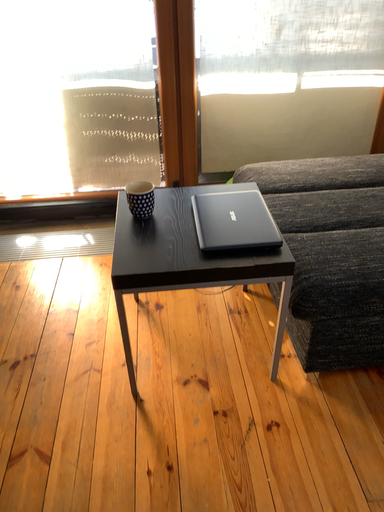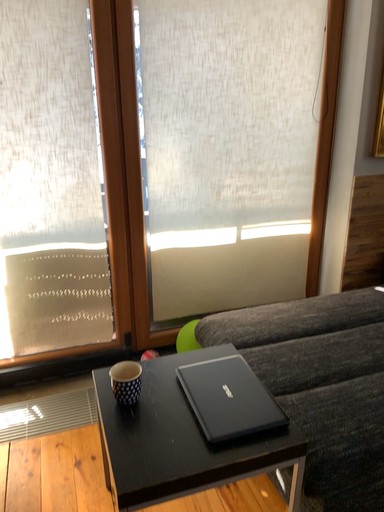
Question: How did the camera likely rotate when shooting the video?

Choices:
 (A) rotated upward
 (B) rotated downward

Answer: (A)